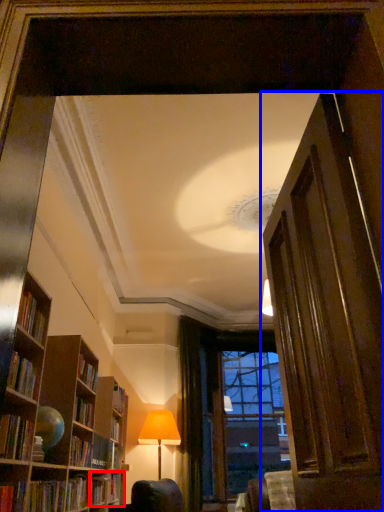
Question: Which of the following is the closest to the observer, book (highlighted by a red box) or door (highlighted by a blue box)?

Choices:
 (A) book
 (B) door

Answer: (B)